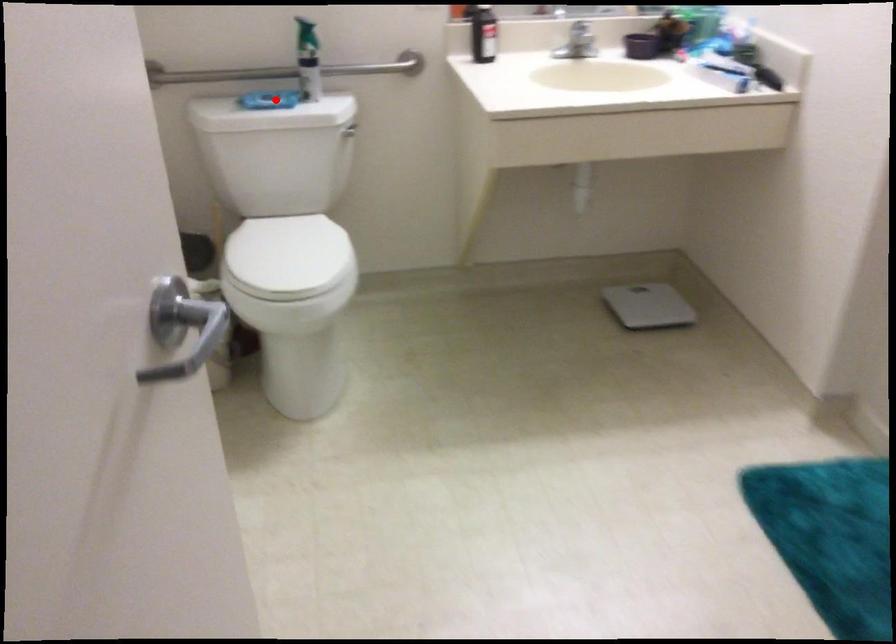
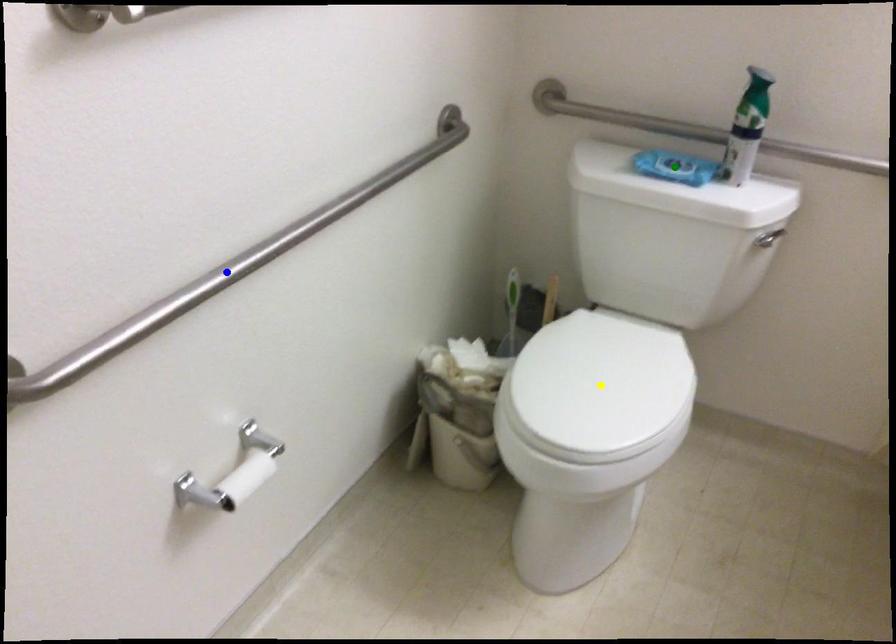
Question: I am providing you with two images of the same scene from different viewpoints. A red point is marked on the first image. You are given multiple points on the second image. Which point in image 2 represents the same 3d spot as the red point in image 1?

Choices:
 (A) blue point
 (B) yellow point
 (C) green point

Answer: (C)